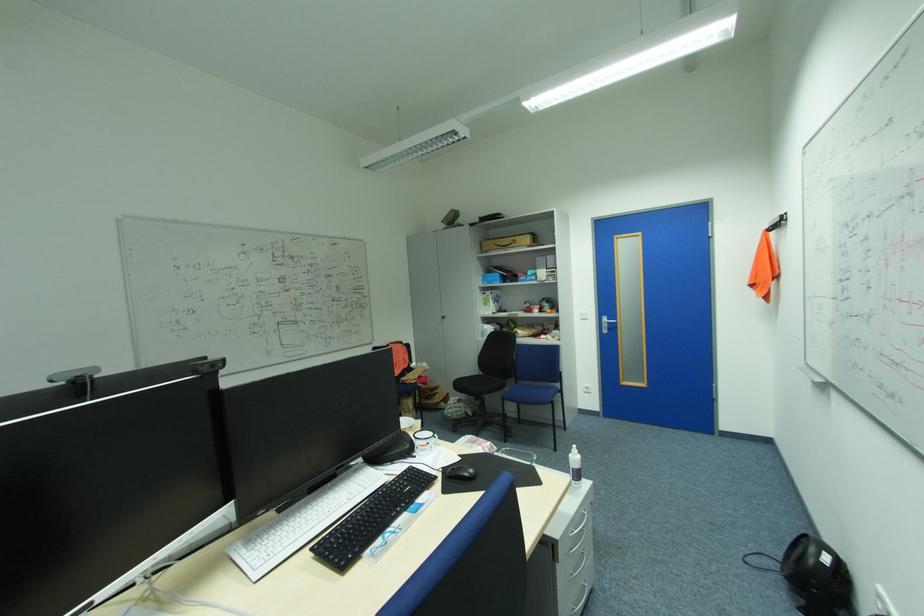
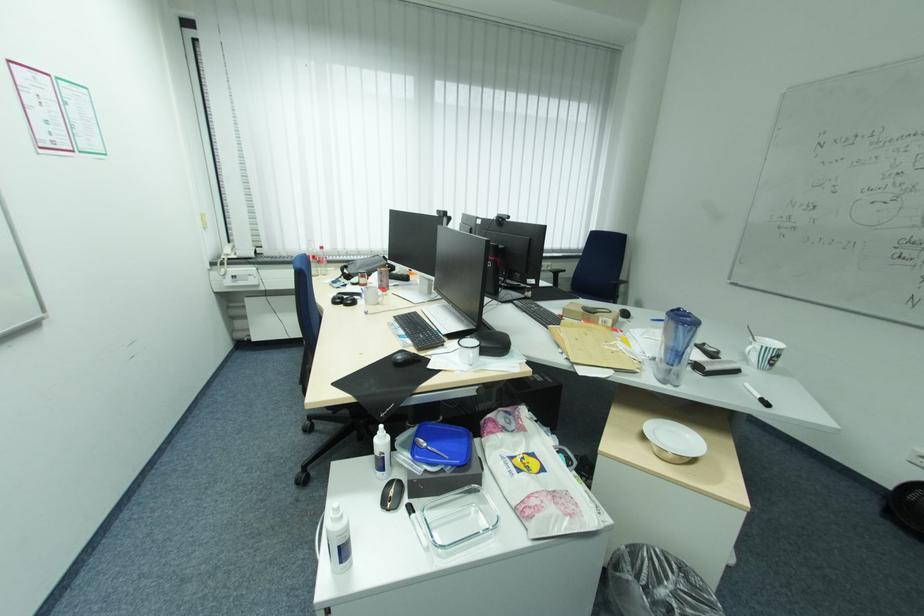
Find the pixel in the second image that matches (395,530) in the first image.

(407, 329)